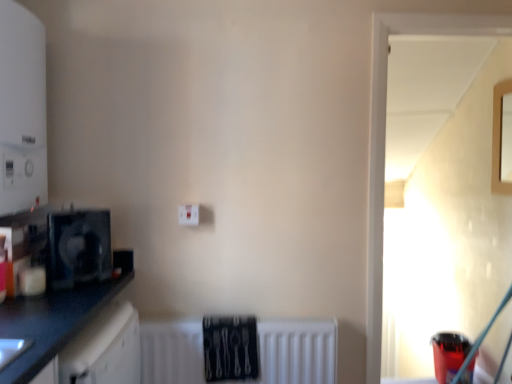
Question: Is point (509, 170) positioned closer to the camera than point (96, 309)?

Choices:
 (A) closer
 (B) farther

Answer: (B)

Question: Relative to black matte countertop at left, is wooden frame at upper right, the first window positioned from the back, in front or behind?

Choices:
 (A) front
 (B) behind

Answer: (B)

Question: Based on their relative distances, which object is farther from the black matte countertop at left?

Choices:
 (A) black plastic fan at left, which ranks as the 1th appliance in top-to-bottom order
 (B) white matte radiator at lower center
 (C) white plastic electric outlet at center
 (D) wooden frame at upper right, which appears as the 2th window when viewed from the front
 (E) translucent plastic cup at lower right, the 2th appliance viewed from the top

Answer: (D)

Question: Estimate the real-world distances between objects in this image. Which object is closer to the black matte countertop at left?

Choices:
 (A) wooden frame at upper right, which appears as the 2th window when viewed from the front
 (B) transparent glass door at upper right, which is counted as the 2th window, starting from the right
 (C) white plastic electric outlet at center
 (D) black plastic fan at left, which is the second appliance from right to left
 (E) translucent plastic cup at lower right, acting as the 1th appliance starting from the right

Answer: (D)